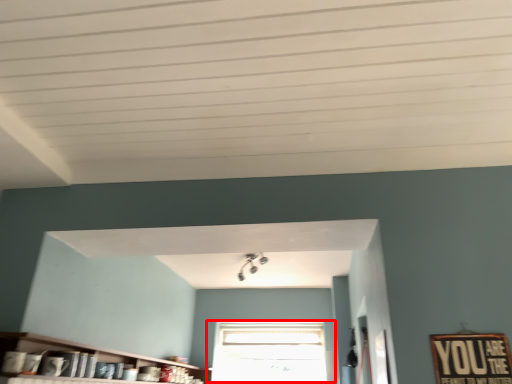
Question: From the image's perspective, where is window (annotated by the red box) located relative to shelf?

Choices:
 (A) below
 (B) above

Answer: (A)